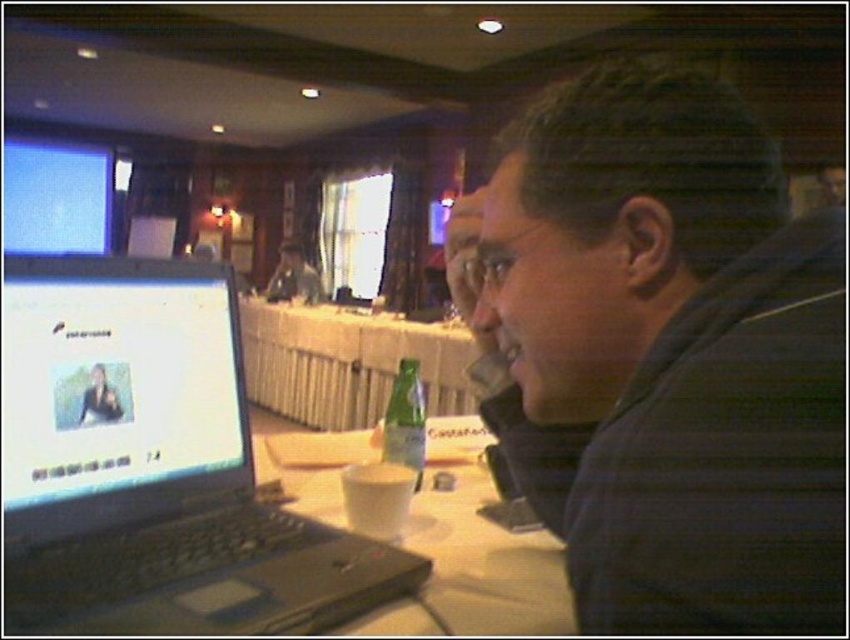
You are organizing a meeting and need to place a 12 inch wide laptop between the dark blue striped shirt at center and the green glass bottle at center. Can the laptop fit between them?

The dark blue striped shirt at center and green glass bottle at center are 18.68 inches apart. Since the laptop is 12 inches wide, there is enough space between them to place the laptop.

You are organizing a meeting and need to place a name tag on the table. The name tag is small and needs to be placed to the left of the white paper at center. Where should you place it relative to the white wood table at center?

The white paper at center is on the right side of the white wood table at center, so you should place the name tag to the left side of the white wood table at center to ensure it is to the left of the white paper at center.